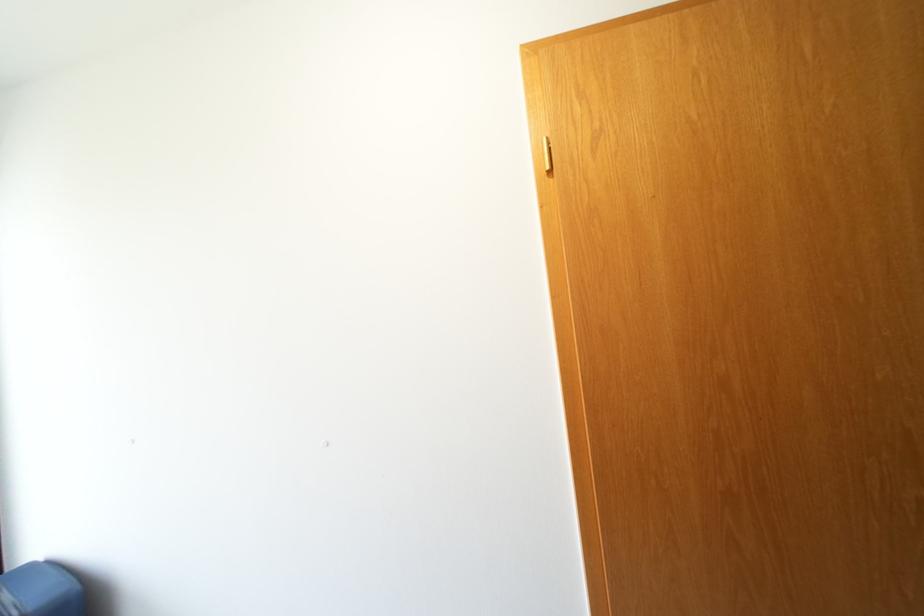
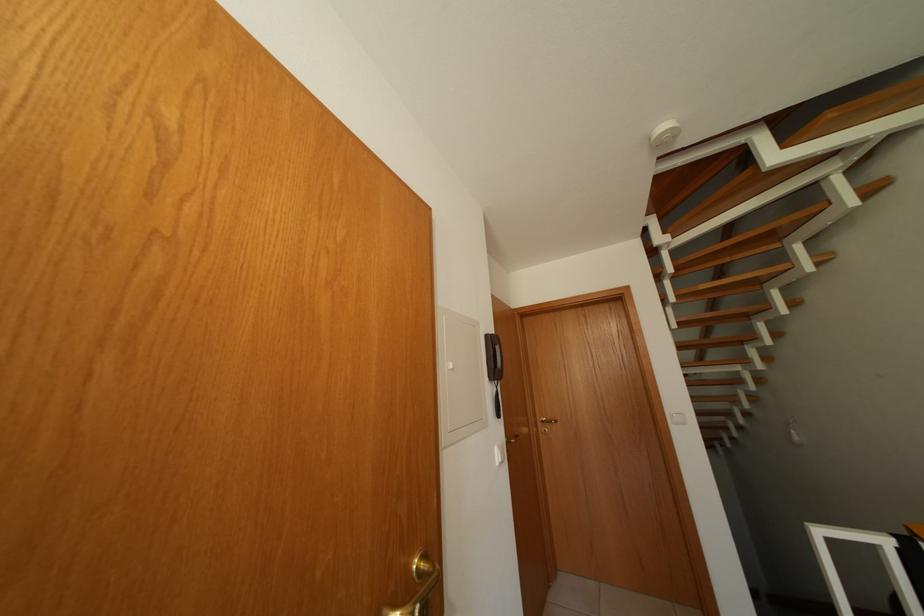
Based on the continuous images, in which direction is the camera rotating?

The camera's rotation is toward right-up.